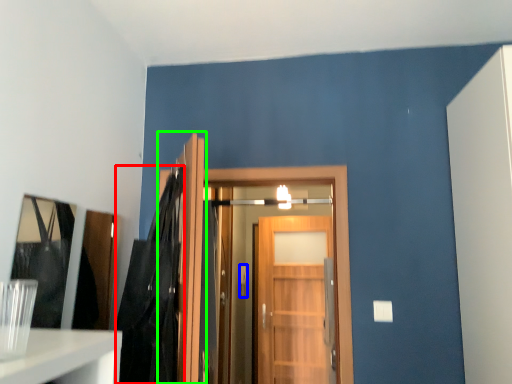
Question: Which object is the farthest from dark (highlighted by a red box)? Choose among these: door handle (highlighted by a blue box) or door (highlighted by a green box).

Choices:
 (A) door handle
 (B) door

Answer: (A)